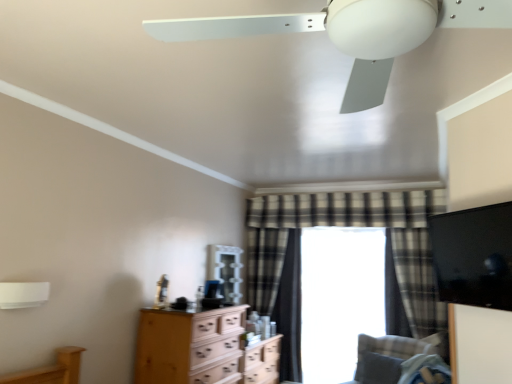
Question: Is white matte lamp at upper left looking in the opposite direction of transparent glass window at center?

Choices:
 (A) yes
 (B) no

Answer: (B)

Question: Does white matte lamp at upper left have a smaller size compared to transparent glass window at center?

Choices:
 (A) yes
 (B) no

Answer: (A)

Question: Is white matte lamp at upper left wider than transparent glass window at center?

Choices:
 (A) yes
 (B) no

Answer: (B)

Question: From a real-world perspective, is white matte lamp at upper left located higher than transparent glass window at center?

Choices:
 (A) no
 (B) yes

Answer: (B)

Question: Is white matte lamp at upper left to the left of transparent glass window at center from the viewer's perspective?

Choices:
 (A) yes
 (B) no

Answer: (A)

Question: Considering the relative sizes of white matte lamp at upper left and transparent glass window at center in the image provided, is white matte lamp at upper left bigger than transparent glass window at center?

Choices:
 (A) no
 (B) yes

Answer: (A)

Question: Is the position of white matte ceiling fan at upper center less distant than that of gray fabric pillow at lower right?

Choices:
 (A) yes
 (B) no

Answer: (A)

Question: Does white matte ceiling fan at upper center turn towards gray fabric pillow at lower right?

Choices:
 (A) no
 (B) yes

Answer: (A)

Question: Does white matte ceiling fan at upper center touch gray fabric pillow at lower right?

Choices:
 (A) no
 (B) yes

Answer: (A)

Question: Is gray fabric pillow at lower right completely or partially inside white matte ceiling fan at upper center?

Choices:
 (A) no
 (B) yes

Answer: (A)

Question: Can you confirm if white matte ceiling fan at upper center is bigger than gray fabric pillow at lower right?

Choices:
 (A) no
 (B) yes

Answer: (B)

Question: From a real-world perspective, is white matte ceiling fan at upper center located higher than gray fabric pillow at lower right?

Choices:
 (A) yes
 (B) no

Answer: (A)

Question: Is white matte lamp at upper left surrounded by plaid fabric curtain at center, positioned as the first curtain in right-to-left order?

Choices:
 (A) no
 (B) yes

Answer: (A)